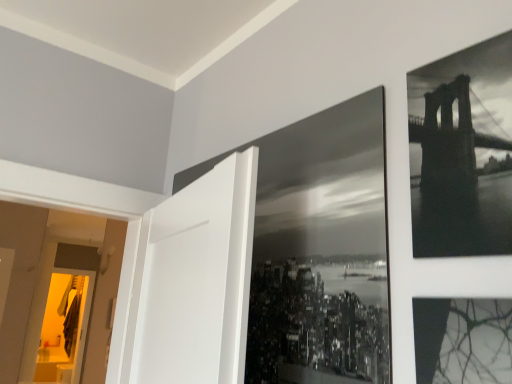
The width and height of the screenshot is (512, 384). In order to click on monochrome metallic bridge at upper right in this screenshot , I will do `click(459, 180)`.

Describe the element at coordinates (459, 180) in the screenshot. Image resolution: width=512 pixels, height=384 pixels. I see `monochrome metallic bridge at upper right` at that location.

The height and width of the screenshot is (384, 512). What do you see at coordinates (319, 249) in the screenshot?
I see `black glossy photo frame at center` at bounding box center [319, 249].

I want to click on black glossy photo frame at center, so click(x=319, y=249).

Measure the distance between point (348,224) and camera.

Point (348,224) is 30.55 inches away from camera.

The width and height of the screenshot is (512, 384). What are the coordinates of `monochrome metallic bridge at upper right` in the screenshot? It's located at (459, 180).

Can you confirm if monochrome metallic bridge at upper right is positioned to the left of black glossy photo frame at center?

No, monochrome metallic bridge at upper right is not to the left of black glossy photo frame at center.

Is monochrome metallic bridge at upper right further to camera compared to black glossy photo frame at center?

No, monochrome metallic bridge at upper right is closer to the viewer.

Is point (477, 214) less distant than point (324, 142)?

Yes, it is.

From the image's perspective, does monochrome metallic bridge at upper right appear higher than black glossy photo frame at center?

Yes, from the image's perspective, monochrome metallic bridge at upper right is over black glossy photo frame at center.

From a real-world perspective, is monochrome metallic bridge at upper right on black glossy photo frame at center?

Yes, from a real-world perspective, monochrome metallic bridge at upper right is on top of black glossy photo frame at center.

Is monochrome metallic bridge at upper right thinner than black glossy photo frame at center?

No, monochrome metallic bridge at upper right is not thinner than black glossy photo frame at center.

Between monochrome metallic bridge at upper right and black glossy photo frame at center, which one has less height?

monochrome metallic bridge at upper right.

Who is bigger, monochrome metallic bridge at upper right or black glossy photo frame at center?

black glossy photo frame at center is bigger.

Is monochrome metallic bridge at upper right located outside black glossy photo frame at center?

Absolutely, monochrome metallic bridge at upper right is external to black glossy photo frame at center.

Is monochrome metallic bridge at upper right far away from black glossy photo frame at center?

They are positioned close to each other.

Could you tell me if monochrome metallic bridge at upper right is turned towards black glossy photo frame at center?

No, monochrome metallic bridge at upper right is not turned towards black glossy photo frame at center.

Can you tell me how much monochrome metallic bridge at upper right and black glossy photo frame at center differ in facing direction?

0.00076 degrees separate the facing orientations of monochrome metallic bridge at upper right and black glossy photo frame at center.

Locate an element on the screen. Golden Gate Bridge on the right of black glossy photo frame at center is located at coordinates (459, 180).

Is black glossy photo frame at center at the left side of monochrome metallic bridge at upper right?

Indeed, black glossy photo frame at center is positioned on the left side of monochrome metallic bridge at upper right.

Which is behind, black glossy photo frame at center or monochrome metallic bridge at upper right?

black glossy photo frame at center is more distant.

Which is in front, point (288, 207) or point (500, 253)?

The point (500, 253) is more forward.

From the image's perspective, between black glossy photo frame at center and monochrome metallic bridge at upper right, which one is located above?

monochrome metallic bridge at upper right appears higher in the image.

From a real-world perspective, who is located higher, black glossy photo frame at center or monochrome metallic bridge at upper right?

In real-world perspective, monochrome metallic bridge at upper right is above.

Is black glossy photo frame at center wider or thinner than monochrome metallic bridge at upper right?

Considering their sizes, black glossy photo frame at center looks slimmer than monochrome metallic bridge at upper right.

Between black glossy photo frame at center and monochrome metallic bridge at upper right, which one has more height?

black glossy photo frame at center is taller.

Between black glossy photo frame at center and monochrome metallic bridge at upper right, which one has larger size?

black glossy photo frame at center is bigger.

Is black glossy photo frame at center positioned beyond the bounds of monochrome metallic bridge at upper right?

That's correct, black glossy photo frame at center is outside of monochrome metallic bridge at upper right.

Are black glossy photo frame at center and monochrome metallic bridge at upper right far apart?

No, there isn't a large distance between black glossy photo frame at center and monochrome metallic bridge at upper right.

Is black glossy photo frame at center oriented away from monochrome metallic bridge at upper right?

black glossy photo frame at center is not turned away from monochrome metallic bridge at upper right.

Can you tell me how much black glossy photo frame at center and monochrome metallic bridge at upper right differ in facing direction?

black glossy photo frame at center and monochrome metallic bridge at upper right are facing 0.00076 degrees away from each other.

Locate an element on the screen. Golden Gate Bridge on the right of black glossy photo frame at center is located at coordinates (459, 180).

At what (x,y) coordinates should I click in order to perform the action: click on picture frame below the monochrome metallic bridge at upper right (from a real-world perspective). Please return your answer as a coordinate pair (x, y). Looking at the image, I should click on (319, 249).

This screenshot has width=512, height=384. I want to click on Golden Gate Bridge in front of the black glossy photo frame at center, so click(459, 180).